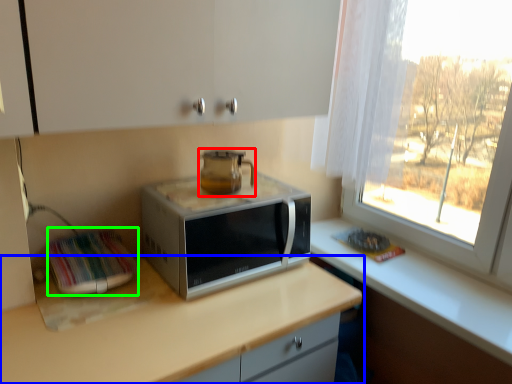
Question: Which is nearer to the home appliance (highlighted by a red box)? countertop (highlighted by a blue box) or appliance (highlighted by a green box).

Choices:
 (A) countertop
 (B) appliance

Answer: (B)